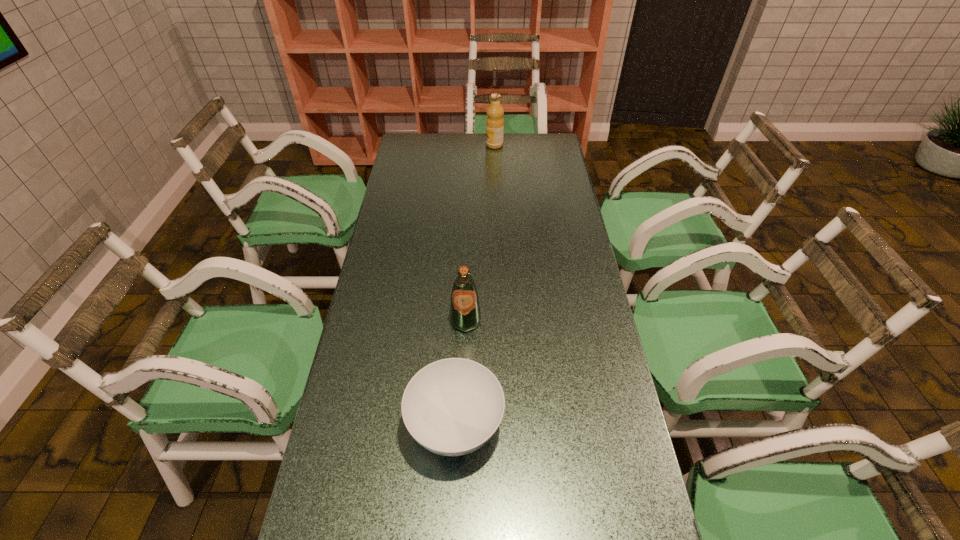
At what (x,y) coordinates should I click in order to perform the action: click on the right olive oil. Please return your answer as a coordinate pair (x, y). This screenshot has height=540, width=960. Looking at the image, I should click on (494, 123).

The height and width of the screenshot is (540, 960). Find the location of `the farthest object`. the farthest object is located at coordinates (494, 123).

The height and width of the screenshot is (540, 960). What are the coordinates of `the left olive oil` in the screenshot? It's located at [x=465, y=315].

Find the location of `the second nearest object`. the second nearest object is located at coordinates (465, 315).

The width and height of the screenshot is (960, 540). I want to click on the shortest object, so click(452, 407).

Locate an element on the screen. This screenshot has width=960, height=540. the nearest object is located at coordinates (452, 407).

This screenshot has height=540, width=960. I want to click on vacant space situated 0.350m on the label of the farthest object, so click(411, 145).

This screenshot has height=540, width=960. What are the coordinates of `vacant area located 0.080m on the label of the farthest object` in the screenshot? It's located at (468, 145).

Locate an element on the screen. vacant area situated 0.180m on the label of the farthest object is located at coordinates (447, 145).

The height and width of the screenshot is (540, 960). What are the coordinates of `vacant region located 0.370m on the front-facing side of the nearer olive oil` in the screenshot? It's located at (462, 460).